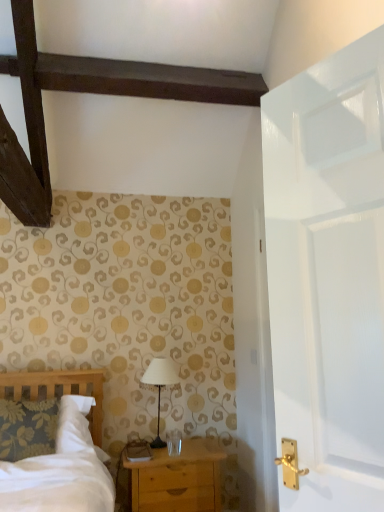
Question: Considering the positions of light brown wooden chest of drawers at lower center and white fabric lampshade at center in the image, is light brown wooden chest of drawers at lower center wider or thinner than white fabric lampshade at center?

Choices:
 (A) wide
 (B) thin

Answer: (A)

Question: Considering their positions, is light brown wooden chest of drawers at lower center located in front of or behind white fabric lampshade at center?

Choices:
 (A) behind
 (B) front

Answer: (B)

Question: Considering the positions of point (162, 458) and point (140, 380), is point (162, 458) closer or farther from the camera than point (140, 380)?

Choices:
 (A) farther
 (B) closer

Answer: (B)

Question: Visually, is white fabric lampshade at center positioned to the left or to the right of light brown wooden chest of drawers at lower center?

Choices:
 (A) left
 (B) right

Answer: (A)

Question: In terms of size, does white fabric lampshade at center appear bigger or smaller than light brown wooden chest of drawers at lower center?

Choices:
 (A) big
 (B) small

Answer: (B)

Question: Considering the positions of point (158, 364) and point (208, 438), is point (158, 364) closer or farther from the camera than point (208, 438)?

Choices:
 (A) closer
 (B) farther

Answer: (A)

Question: From the image's perspective, is white fabric lampshade at center above or below light brown wooden chest of drawers at lower center?

Choices:
 (A) above
 (B) below

Answer: (A)